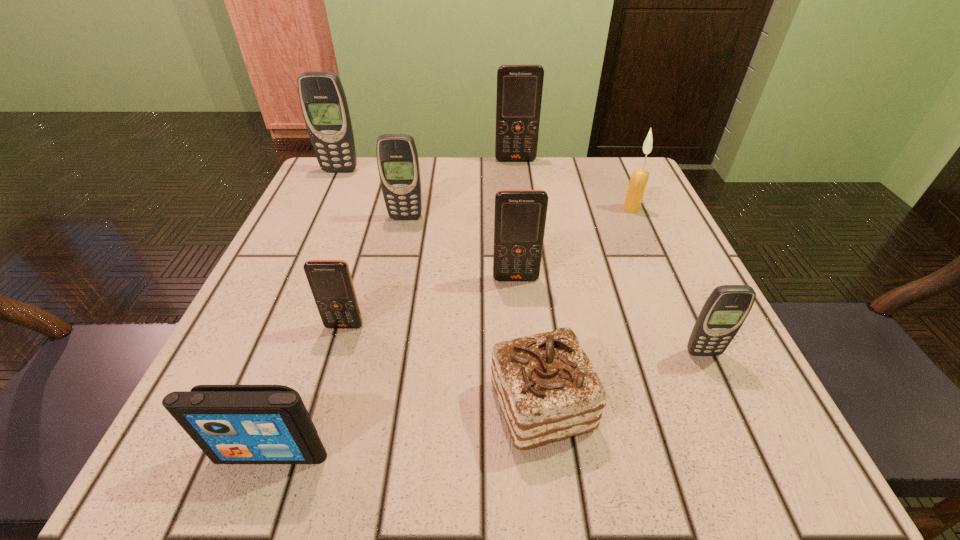
Locate an element on the screen. The image size is (960, 540). free space between the fourth farthest object and the chocolate cake is located at coordinates (473, 312).

Locate an element on the screen. The height and width of the screenshot is (540, 960). vacant area that lies between the candle and the nearest cellular telephone is located at coordinates [667, 281].

Identify the location of vacant area between the second farthest cellular telephone and the cream candle. (486, 190).

The width and height of the screenshot is (960, 540). Find the location of `free space between the farthest object and the nearest gray cellular telephone`. free space between the farthest object and the nearest gray cellular telephone is located at coordinates (610, 256).

Locate an element on the screen. The image size is (960, 540). vacant region between the leftmost orange cellular telephone and the seventh nearest object is located at coordinates (488, 267).

Identify the location of vacant space in between the leftmost cellular telephone and the second nearest gray cellular telephone. Image resolution: width=960 pixels, height=540 pixels. (372, 194).

Where is `the fifth closest object relative to the biggest orange cellular telephone`? the fifth closest object relative to the biggest orange cellular telephone is located at coordinates (330, 281).

Locate an element on the screen. Image resolution: width=960 pixels, height=540 pixels. object that is the sixth closest to the candle is located at coordinates (330, 281).

Select which cellular telephone appears as the third closest to the fifth farthest object. Please provide its 2D coordinates. Your answer should be formatted as a tuple, i.e. [(x, y)], where the tuple contains the x and y coordinates of a point satisfying the conditions above.

[(727, 307)]

Identify which cellular telephone is the fourth nearest to the iPod. Please provide its 2D coordinates. Your answer should be formatted as a tuple, i.e. [(x, y)], where the tuple contains the x and y coordinates of a point satisfying the conditions above.

[(727, 307)]